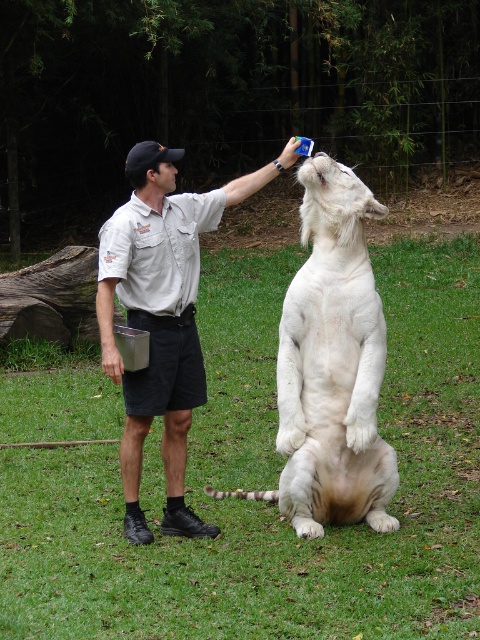
You are a zookeeper observing the scene. The white fur tiger at center and the light beige uniform at center are in your line of sight. Which one is positioned lower in the image?

The white fur tiger at center is positioned lower than the light beige uniform at center in the image.

Based on the coordinates provided in the description, where is the white fur tiger at center located?

The white fur tiger at center is located at coordinates point (x=332, y=365).